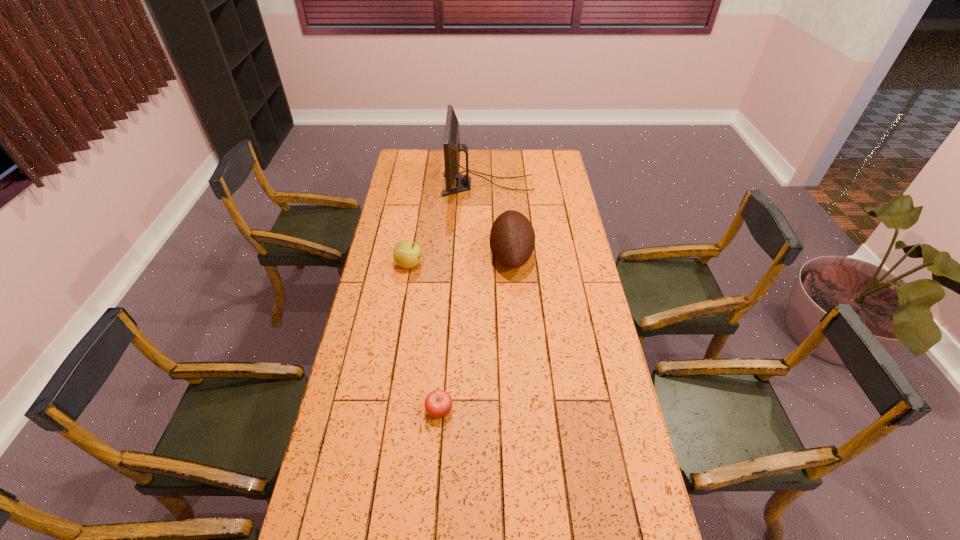
The width and height of the screenshot is (960, 540). Find the location of `free space at the far left corner of the desktop`. free space at the far left corner of the desktop is located at coordinates (401, 152).

You are a GUI agent. You are given a task and a screenshot of the screen. Output one action in this format:
    pyautogui.click(x=<x>, y=<y>)
    Task: Click on the free space at the far right corner
    The height and width of the screenshot is (540, 960).
    Given the screenshot: What is the action you would take?
    pyautogui.click(x=558, y=170)

You are a GUI agent. You are given a task and a screenshot of the screen. Output one action in this format:
    pyautogui.click(x=<x>, y=<y>)
    Task: Click on the unoccupied area between the second tallest object and the apple
    
    Given the screenshot: What is the action you would take?
    pyautogui.click(x=475, y=333)

At what (x,y) coordinates should I click in order to perform the action: click on vacant region between the second shortest object and the computer monitor. Please return your answer as a coordinate pair (x, y). The width and height of the screenshot is (960, 540). Looking at the image, I should click on (448, 224).

You are a GUI agent. You are given a task and a screenshot of the screen. Output one action in this format:
    pyautogui.click(x=<x>, y=<y>)
    Task: Click on the free area in between the apple and the farthest object
    The image size is (960, 540).
    Given the screenshot: What is the action you would take?
    pyautogui.click(x=464, y=297)

At what (x,y) coordinates should I click in order to perform the action: click on vacant region between the farthest object and the nearest object. Please return your answer as a coordinate pair (x, y). Looking at the image, I should click on (464, 297).

The height and width of the screenshot is (540, 960). I want to click on free spot between the apple and the farthest object, so click(464, 297).

At what (x,y) coordinates should I click in order to perform the action: click on the third closest object to the softball. Please return your answer as a coordinate pair (x, y). Looking at the image, I should click on (438, 403).

Find the location of a particular element. The image size is (960, 540). object that ranks as the closest to the nearest object is located at coordinates point(512,238).

Where is `vacant space that satisfies the following two spatial constraints: 1. on the logo side of the softball; 2. on the left side of the nearest object`? vacant space that satisfies the following two spatial constraints: 1. on the logo side of the softball; 2. on the left side of the nearest object is located at coordinates (384, 410).